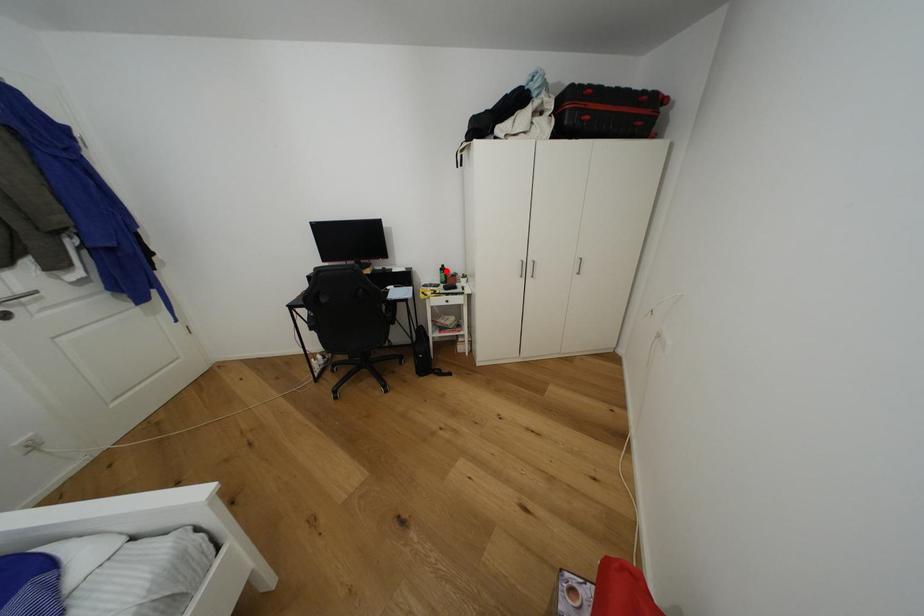
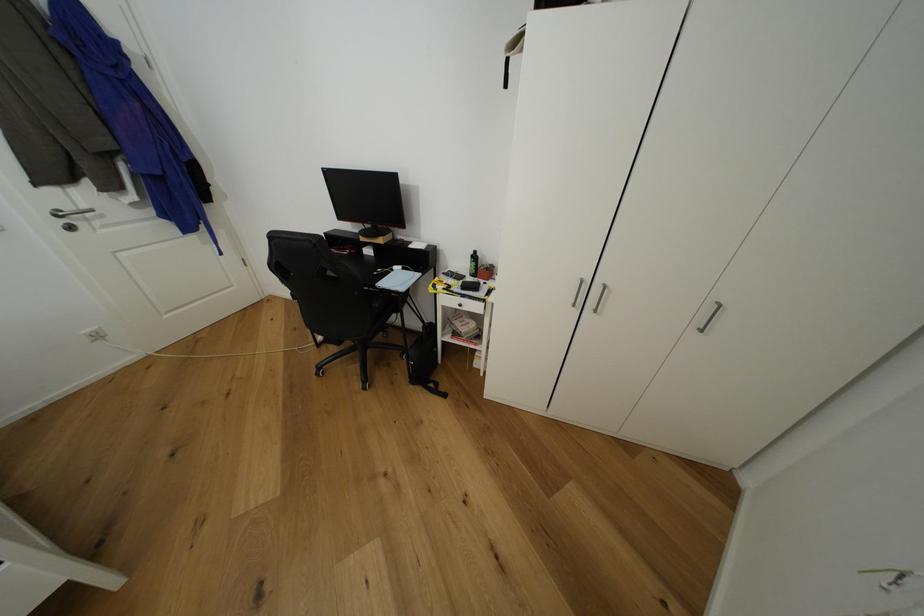
The point at the highlighted location is marked in the first image. Where is the corresponding point in the second image?

(478, 257)